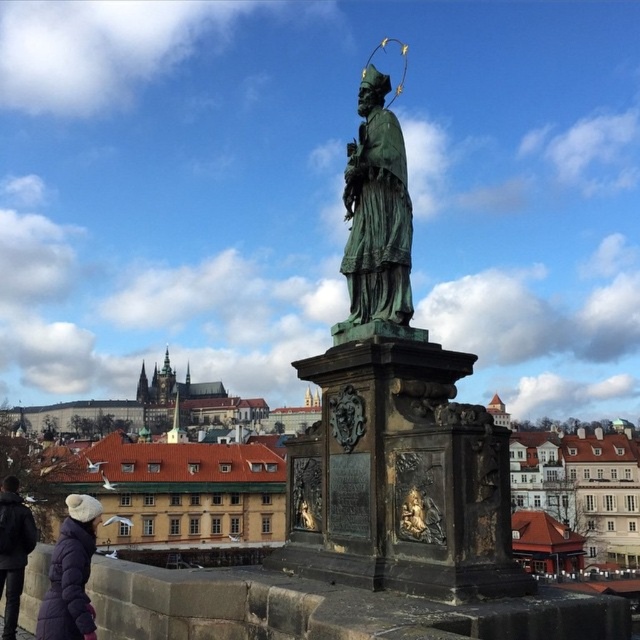
Consider the image. You are a tourist standing in front of the statue and want to take a photo of both the green patina statue at center and the dark gray jacket at lower left. Can you capture both in the same frame without moving your position?

The green patina statue at center is closer to the viewer than the dark gray jacket at lower left, so yes, both can be captured in the same frame without moving your position.

You are an artist planning to paint the scene. You want to ensure the green patina statue at center and the purple puffy coat at lower left are proportionally accurate. Which object should you depict as narrower in your painting?

The green patina statue at center has a lesser width compared to the purple puffy coat at lower left, so you should depict the green patina statue at center as narrower in your painting.

You are an architect analyzing the city layout. You notice a point at coordinates (394,417) in the image. Based on the scene, what object does this point likely correspond to?

The point at coordinates (394,417) corresponds to the green patina statue at center.